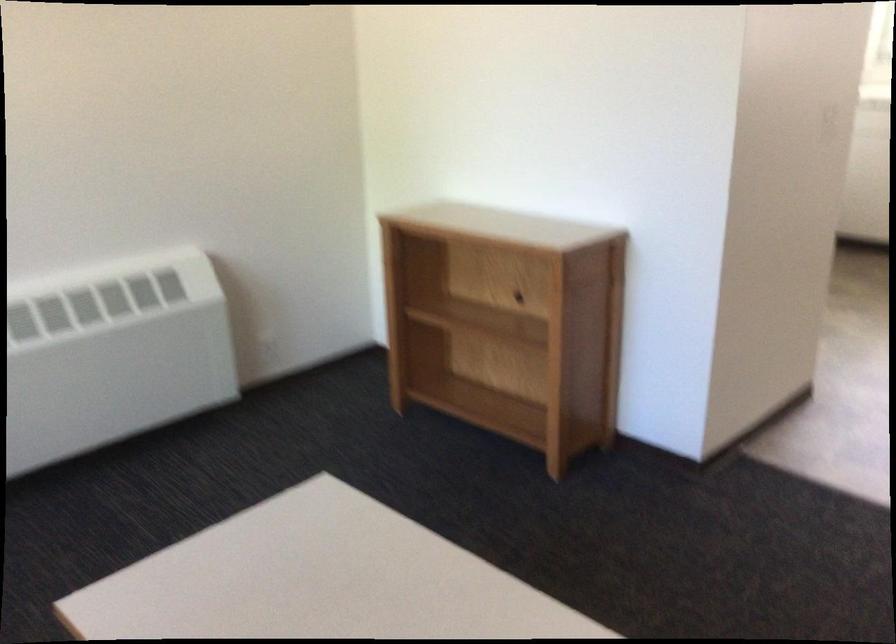
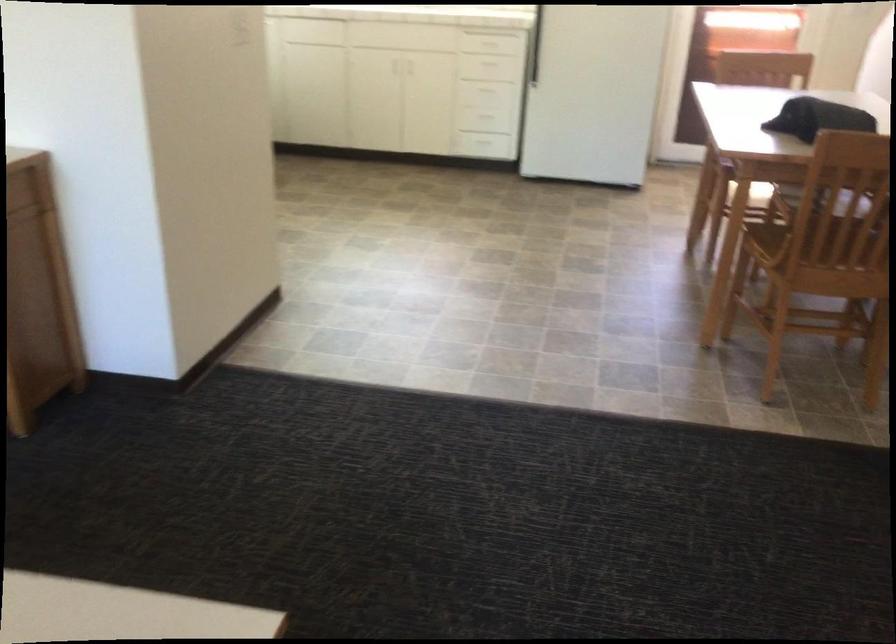
Question: The camera is either moving clockwise (left) or counter-clockwise (right) around the object. The first image is from the beginning of the video and the second image is from the end. Is the camera moving left or right when shooting the video?

Choices:
 (A) Left
 (B) Right

Answer: (A)